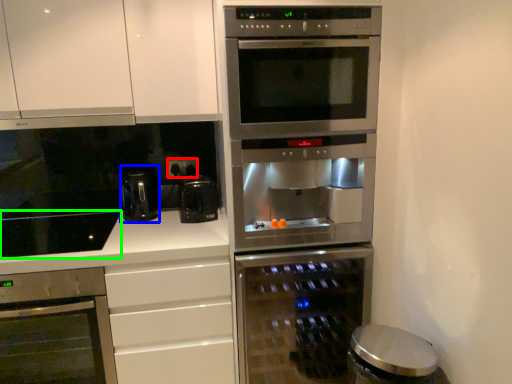
Question: Which object is the closest to the electric outlet (highlighted by a red box)? Choose among these: coffee machine (highlighted by a blue box) or gas stove (highlighted by a green box).

Choices:
 (A) coffee machine
 (B) gas stove

Answer: (A)